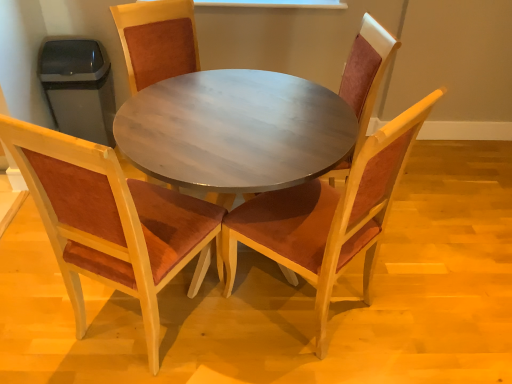
This screenshot has height=384, width=512. I want to click on unoccupied region to the right of velvet red chair at center, the third chair when ordered from left to right, so click(x=408, y=305).